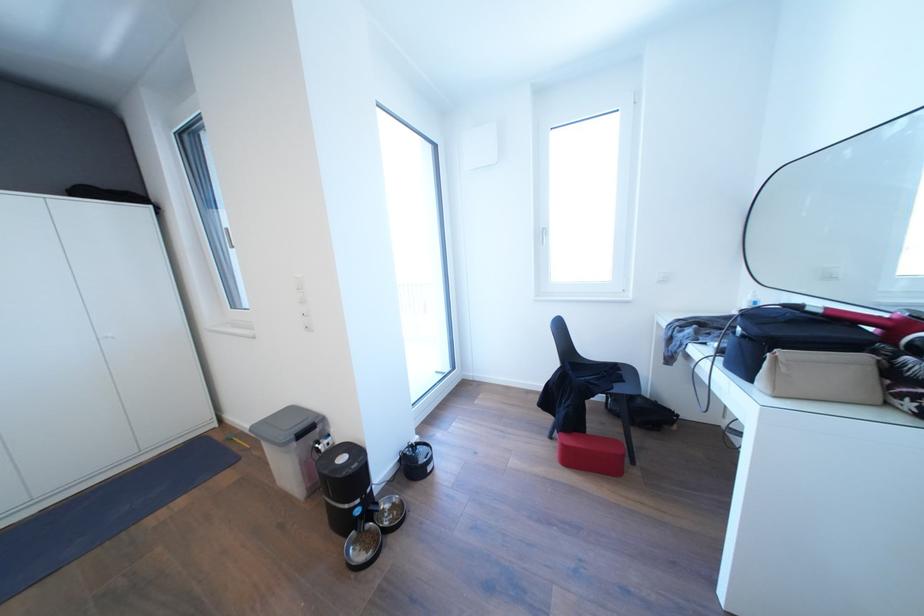
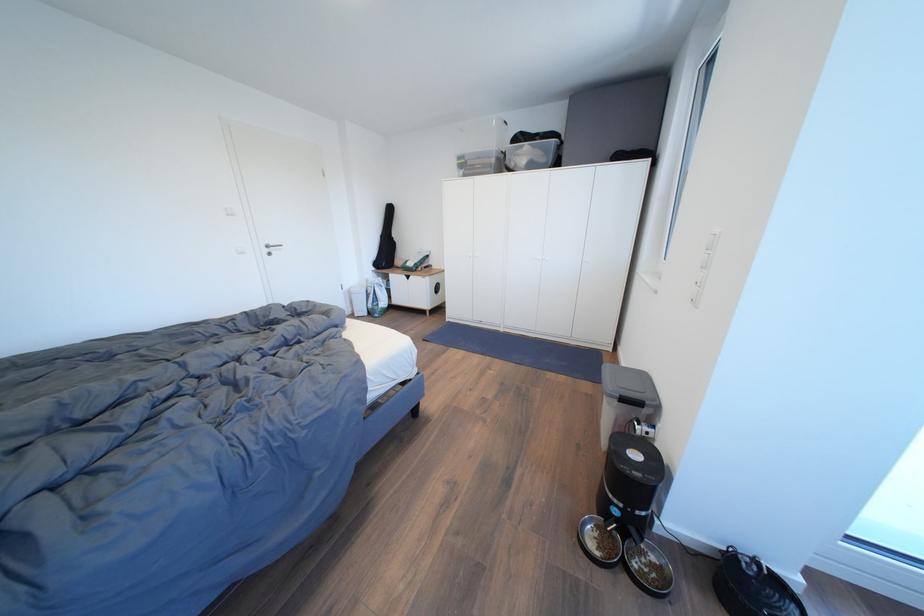
Find the pixel in the second image that matches (299,416) in the first image.

(651, 382)